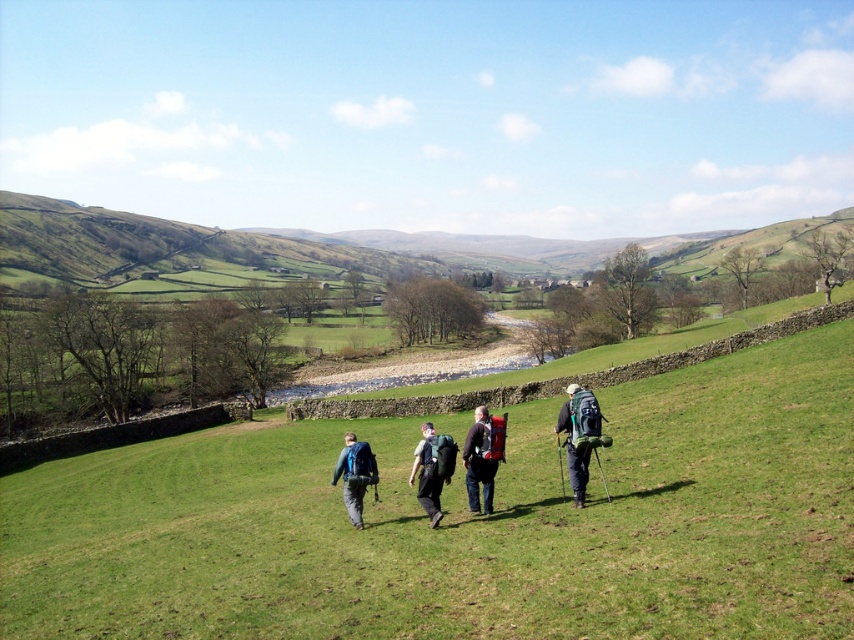
Question: Observing the image, what is the correct spatial positioning of green grassy field at center in reference to matte blue backpack at center?

Choices:
 (A) right
 (B) left

Answer: (A)

Question: Can you confirm if green grassy field at center is bigger than matte green backpack at center?

Choices:
 (A) yes
 (B) no

Answer: (A)

Question: Which of the following is the farthest from the observer?

Choices:
 (A) matte green backpack at center
 (B) matte black backpack at center
 (C) matte blue backpack at center
 (D) green grassy field at center

Answer: (C)

Question: Considering the real-world distances, which object is closest to the green fabric backpack at center?

Choices:
 (A) matte green backpack at center
 (B) green grassy field at center

Answer: (A)

Question: Which object is the farthest from the matte black backpack at center?

Choices:
 (A) green grassy field at center
 (B) matte green backpack at center
 (C) matte blue backpack at center
 (D) green fabric backpack at center

Answer: (A)

Question: Does green fabric backpack at center appear on the left side of matte blue backpack at center?

Choices:
 (A) no
 (B) yes

Answer: (A)